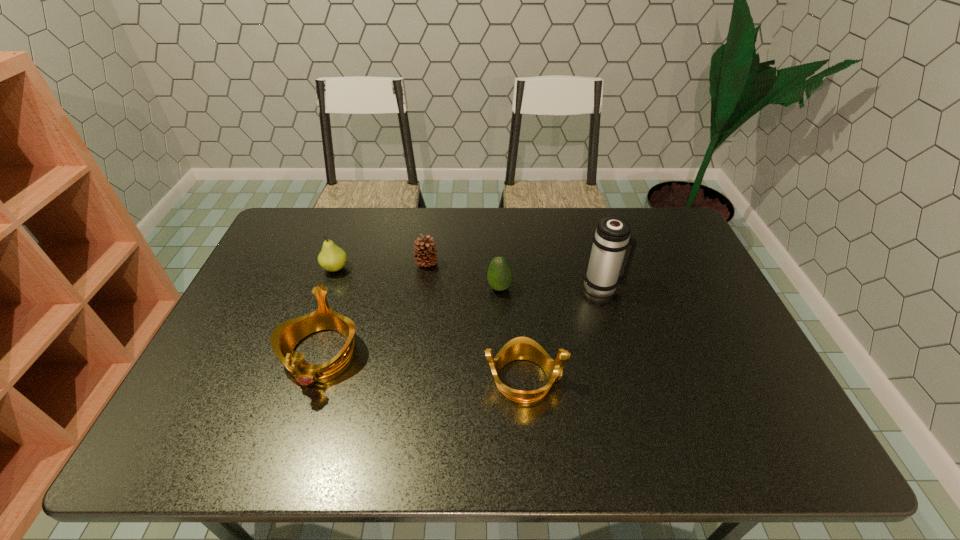
Find the location of a particular element. The image size is (960, 540). vacant area between the rightmost object and the avocado is located at coordinates [x=551, y=287].

Locate an element on the screen. This screenshot has width=960, height=540. empty space between the avocado and the tallest object is located at coordinates (551, 287).

Locate an element on the screen. This screenshot has width=960, height=540. empty space that is in between the tallest object and the shorter tiara is located at coordinates (564, 333).

Where is `vacant area that lies between the avocado and the taller tiara`? This screenshot has height=540, width=960. vacant area that lies between the avocado and the taller tiara is located at coordinates (410, 321).

The image size is (960, 540). I want to click on free space between the right tiara and the pear, so click(x=430, y=323).

Locate an element on the screen. Image resolution: width=960 pixels, height=540 pixels. free space between the avocado and the pinecone is located at coordinates (463, 275).

What are the coordinates of `free space between the fourth object from right to left and the shorter tiara` in the screenshot? It's located at (476, 321).

The image size is (960, 540). Identify the location of blank region between the pear and the tallest object. (469, 277).

At what (x,y) coordinates should I click in order to perform the action: click on vacant space in between the right tiara and the rightmost object. Please return your answer as a coordinate pair (x, y). The width and height of the screenshot is (960, 540). Looking at the image, I should click on (564, 333).

At what (x,y) coordinates should I click in order to perform the action: click on object that is the closest to the rightmost object. Please return your answer as a coordinate pair (x, y). Image resolution: width=960 pixels, height=540 pixels. Looking at the image, I should click on click(499, 275).